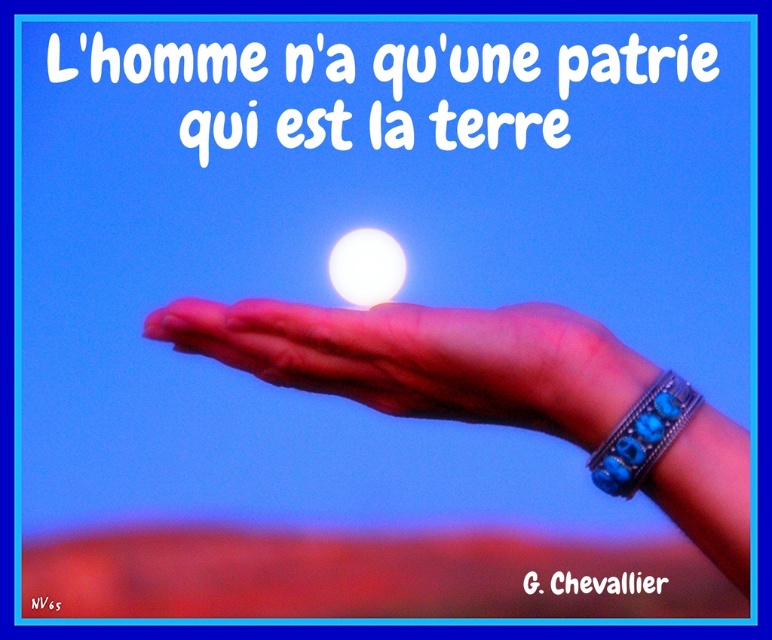
You are an artist trying to paint the scene. You need to decide which of the two points, point (574, 394) or point (628, 468), should be rendered with more depth to show perspective. Based on the scene description, which point should you emphasize as being closer to the viewer?

Point (574, 394) is closer to the viewer than point (628, 468), so you should emphasize point (574, 394) as being closer to show perspective.

You are standing in front of an art installation where you can see the pink leather hand at center holding a glowing orb. If the hand is 20.95 inches away from you, can you comfortably reach out and touch it?

The pink leather hand at center is 20.95 inches away from the viewer, which is approximately 1.75 feet. Since the average human arm length is around 2.5 feet, you can comfortably reach out and touch the pink leather hand at center.